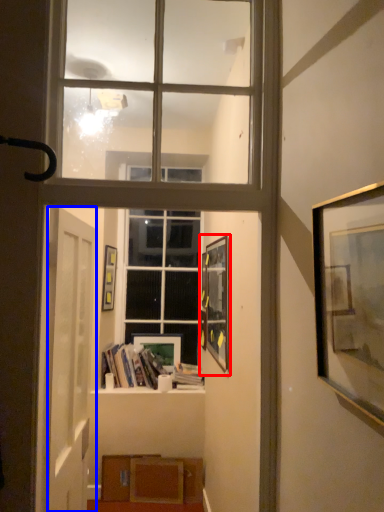
Question: Among these objects, which one is farthest to the camera, picture frame (highlighted by a red box) or door (highlighted by a blue box)?

Choices:
 (A) picture frame
 (B) door

Answer: (A)